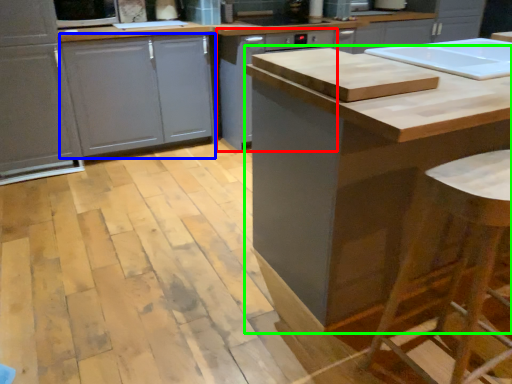
Question: Which object is the closest to the cabinetry (highlighted by a red box)? Choose among these: drawer (highlighted by a blue box) or cabinetry (highlighted by a green box).

Choices:
 (A) drawer
 (B) cabinetry

Answer: (A)